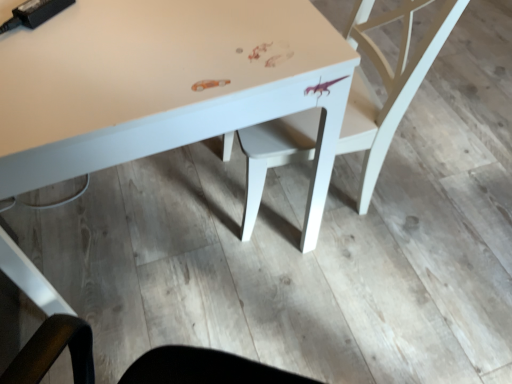
This screenshot has height=384, width=512. I want to click on white matte chair at center, so click(387, 83).

The width and height of the screenshot is (512, 384). What do you see at coordinates (387, 83) in the screenshot?
I see `white matte chair at center` at bounding box center [387, 83].

You are a GUI agent. You are given a task and a screenshot of the screen. Output one action in this format:
    pyautogui.click(x=<x>, y=<y>)
    Task: Click on the matte white table at center
    The height and width of the screenshot is (384, 512).
    Given the screenshot: What is the action you would take?
    pyautogui.click(x=164, y=85)

The height and width of the screenshot is (384, 512). Describe the element at coordinates (164, 85) in the screenshot. I see `matte white table at center` at that location.

Identify the location of white matte chair at center. This screenshot has height=384, width=512. (387, 83).

Can you confirm if matte white table at center is positioned to the right of white matte chair at center?

Incorrect, matte white table at center is not on the right side of white matte chair at center.

Is matte white table at center further to the viewer compared to white matte chair at center?

No, matte white table at center is in front of white matte chair at center.

Is point (23, 137) in front of point (361, 188)?

Yes.

From the image's perspective, who appears lower, matte white table at center or white matte chair at center?

white matte chair at center appears lower in the image.

From a real-world perspective, is matte white table at center below white matte chair at center?

Correct, in the physical world, matte white table at center is lower than white matte chair at center.

Which object is wider, matte white table at center or white matte chair at center?

matte white table at center is wider.

Between matte white table at center and white matte chair at center, which one has more height?

Standing taller between the two is white matte chair at center.

Which of these two, matte white table at center or white matte chair at center, is bigger?

With larger size is matte white table at center.

Could white matte chair at center be considered to be inside matte white table at center?

That's correct, white matte chair at center is inside matte white table at center.

Are matte white table at center and white matte chair at center located far from each other?

That's not correct — matte white table at center is a little close to white matte chair at center.

Is matte white table at center turned away from white matte chair at center?

No, matte white table at center is not facing the opposite direction of white matte chair at center.

Can you tell me how much matte white table at center and white matte chair at center differ in facing direction?

The angular difference between matte white table at center and white matte chair at center is 168 degrees.

The height and width of the screenshot is (384, 512). In order to click on table on the left side of white matte chair at center in this screenshot , I will do 164,85.

Considering the relative positions of white matte chair at center and matte white table at center in the image provided, is white matte chair at center to the left or to the right of matte white table at center?

In the image, white matte chair at center appears on the right side of matte white table at center.

Is white matte chair at center closer to the viewer compared to matte white table at center?

No, white matte chair at center is further to the viewer.

Is point (362, 206) closer to camera compared to point (46, 308)?

No, (362, 206) is behind (46, 308).

Based on the photo, from the image's perspective, who appears lower, white matte chair at center or matte white table at center?

white matte chair at center is shown below in the image.

From a real-world perspective, which is physically above, white matte chair at center or matte white table at center?

white matte chair at center is physically above.

Based on the photo, which of these two, white matte chair at center or matte white table at center, is thinner?

Thinner between the two is white matte chair at center.

Who is taller, white matte chair at center or matte white table at center?

Standing taller between the two is white matte chair at center.

Does white matte chair at center have a larger size compared to matte white table at center?

No.

Is white matte chair at center not within matte white table at center?

No, white matte chair at center is inside matte white table at center's boundary.

Is white matte chair at center touching matte white table at center?

There is a gap between white matte chair at center and matte white table at center.

Does white matte chair at center turn towards matte white table at center?

Yes, white matte chair at center is aimed at matte white table at center.

How many degrees apart are the facing directions of white matte chair at center and matte white table at center?

white matte chair at center and matte white table at center are facing 168 degrees away from each other.

The width and height of the screenshot is (512, 384). Find the location of `table above the white matte chair at center (from the image's perspective)`. table above the white matte chair at center (from the image's perspective) is located at coordinates (164, 85).

Where is `chair above the matte white table at center (from a real-world perspective)`? Image resolution: width=512 pixels, height=384 pixels. chair above the matte white table at center (from a real-world perspective) is located at coordinates (387, 83).

Where is `table on the left of white matte chair at center`? This screenshot has width=512, height=384. table on the left of white matte chair at center is located at coordinates (164, 85).